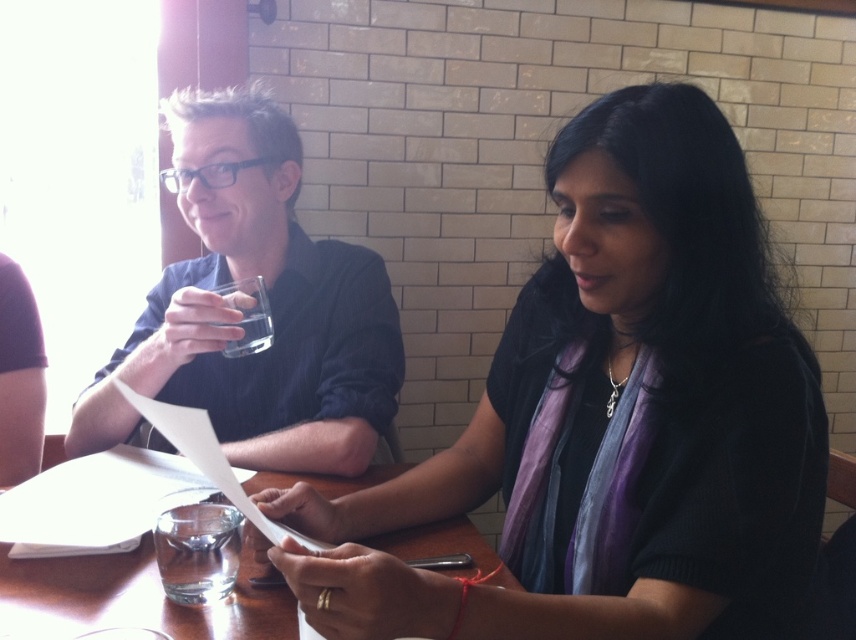
You are a server at the restaurant and need to place a small dessert plate between the black matte sweater at center and the clear glass water at table center. The plate has a diameter of 25 centimeters. Will there be enough space between them to place the plate?

The black matte sweater at center and clear glass water at table center are 40.05 centimeters apart. Since the dessert plate has a diameter of 25 centimeters, which is smaller than the 40.05 cm space between them, there is enough space to place the plate between them.

You are a waiter at a restaurant and need to place a 50 cm long menu on the table between the black matte sweater at center and the clear glass at left. Can you fit it there without moving any items?

The black matte sweater at center is 53.88 centimeters from the clear glass at left, so yes, the 50 cm long menu can fit between them since the distance is greater than the menu length.